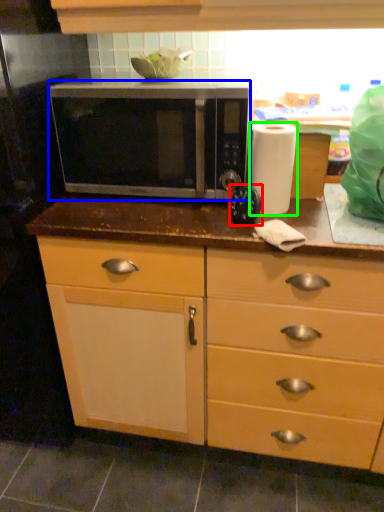
Question: Estimate the real-world distances between objects in this image. Which object is closer to appliance (highlighted by a red box), microwave oven (highlighted by a blue box) or paper towel (highlighted by a green box)?

Choices:
 (A) microwave oven
 (B) paper towel

Answer: (B)